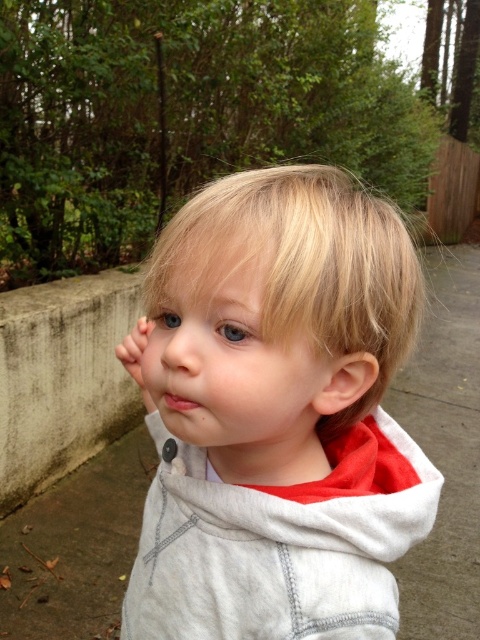
Question: Which of the following is the farthest from the observer?

Choices:
 (A) white cotton hoodie at center
 (B) smooth skin nose at center
 (C) pink matte lips at center

Answer: (C)

Question: Does white cotton hoodie at center have a smaller size compared to pink matte lips at center?

Choices:
 (A) yes
 (B) no

Answer: (B)

Question: Which object is closer to the camera taking this photo?

Choices:
 (A) white cotton hoodie at center
 (B) smooth skin nose at center
 (C) pink matte lips at center

Answer: (A)

Question: In this image, where is smooth skin nose at center located relative to pink matte lips at center?

Choices:
 (A) below
 (B) above

Answer: (B)

Question: Which of these objects is positioned closest to the smooth skin nose at center?

Choices:
 (A) white cotton hoodie at center
 (B) pink matte lips at center

Answer: (B)

Question: Can you confirm if smooth skin nose at center is smaller than pink matte lips at center?

Choices:
 (A) yes
 (B) no

Answer: (B)